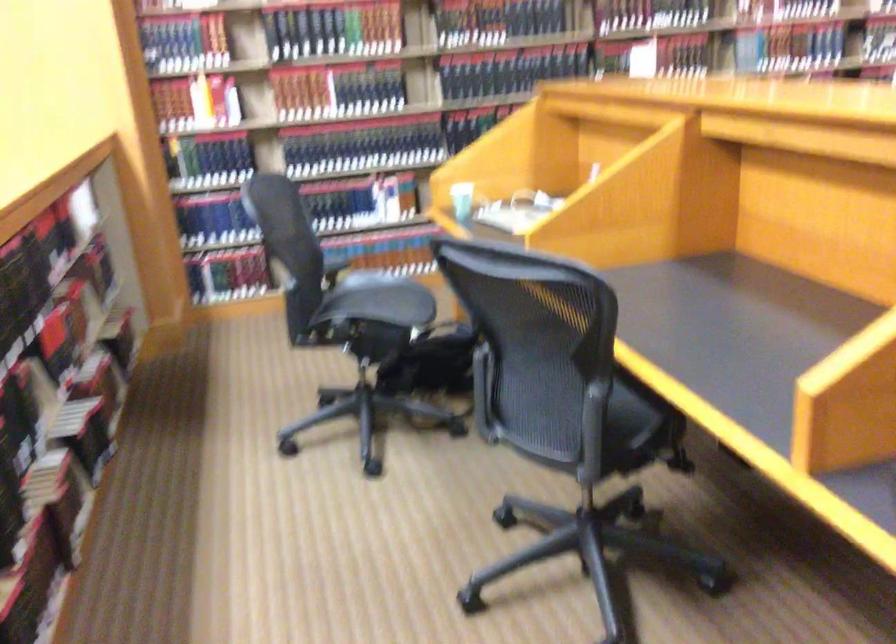
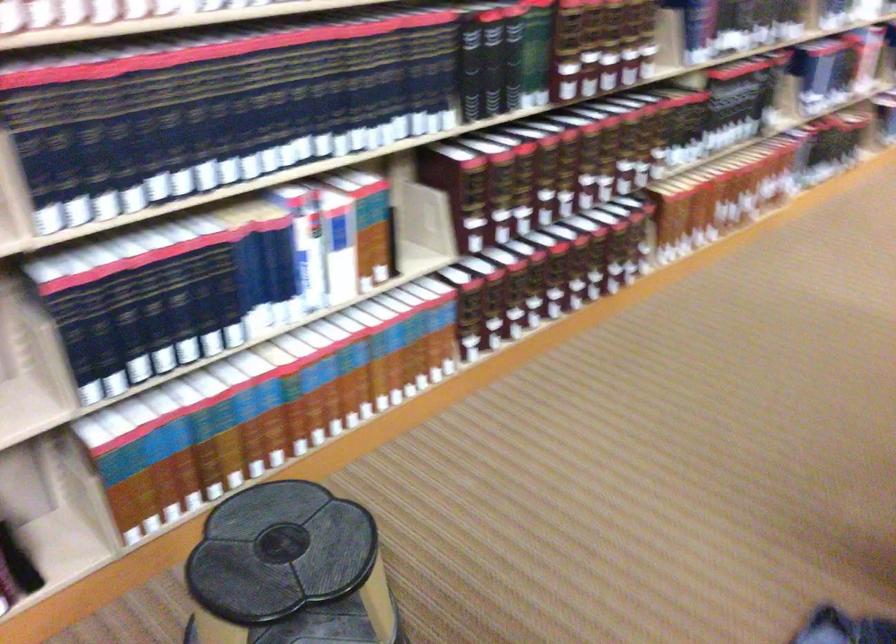
Find the pixel in the second image that matches pixel 371 140 in the first image.

(297, 104)